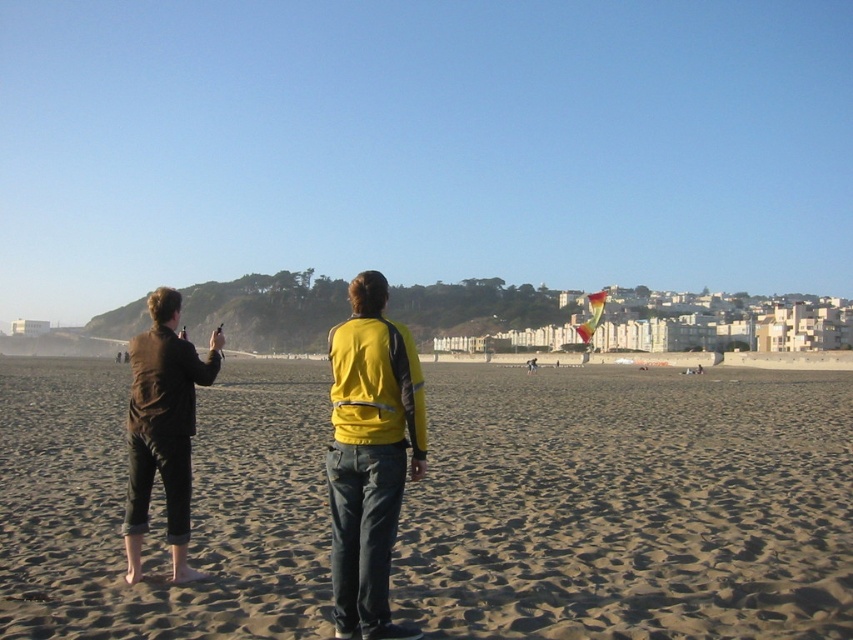
Is dark brown leather jacket at left thinner than multicolored fabric kite at center?

Correct, dark brown leather jacket at left's width is less than multicolored fabric kite at center's.

Between dark brown leather jacket at left and multicolored fabric kite at center, which one appears on the right side from the viewer's perspective?

From the viewer's perspective, multicolored fabric kite at center appears more on the right side.

This screenshot has width=853, height=640. In order to click on dark brown leather jacket at left in this screenshot , I will do `click(163, 428)`.

Image resolution: width=853 pixels, height=640 pixels. I want to click on dark brown leather jacket at left, so click(163, 428).

Can you confirm if brown sand at lower center is shorter than yellow fabric jacket at center?

Indeed, brown sand at lower center has a lesser height compared to yellow fabric jacket at center.

Is point (579, 545) farther from viewer compared to point (376, 483)?

Yes, it is.

Is point (648, 604) closer to viewer compared to point (410, 403)?

Yes, point (648, 604) is in front of point (410, 403).

Where is `brown sand at lower center`? This screenshot has width=853, height=640. brown sand at lower center is located at coordinates 630,506.

Does yellow fabric jacket at center appear under multicolored fabric kite at center?

Yes.

Can you confirm if yellow fabric jacket at center is smaller than multicolored fabric kite at center?

Indeed, yellow fabric jacket at center has a smaller size compared to multicolored fabric kite at center.

This screenshot has height=640, width=853. I want to click on yellow fabric jacket at center, so click(x=370, y=456).

Find the location of a particular element. This screenshot has width=853, height=640. yellow fabric jacket at center is located at coordinates (370, 456).